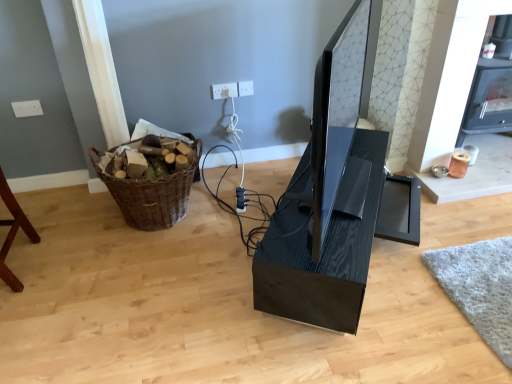
Question: From a real-world perspective, is woven brown basket at left above or below matte black monitor at center?

Choices:
 (A) below
 (B) above

Answer: (A)

Question: In terms of size, does woven brown basket at left appear bigger or smaller than matte black monitor at center?

Choices:
 (A) small
 (B) big

Answer: (A)

Question: Which object is the closest to the white plastic electric outlet at upper center, which ranks as the 2th electric outlet in left-to-right order?

Choices:
 (A) woven brown basket at left
 (B) black plastic plug at center
 (C) matte black monitor at center
 (D) black glossy computer desk at center
 (E) white plastic electric outlet at upper center, the 1th electric outlet viewed from the left

Answer: (E)

Question: Considering the real-world distances, which object is closest to the white plastic electric outlet at upper center, the 1th electric outlet viewed from the left?

Choices:
 (A) matte black monitor at center
 (B) black glossy computer desk at center
 (C) white plastic electric outlet at upper center, which appears as the 1th electric outlet when viewed from the right
 (D) woven brown basket at left
 (E) black plastic plug at center

Answer: (C)